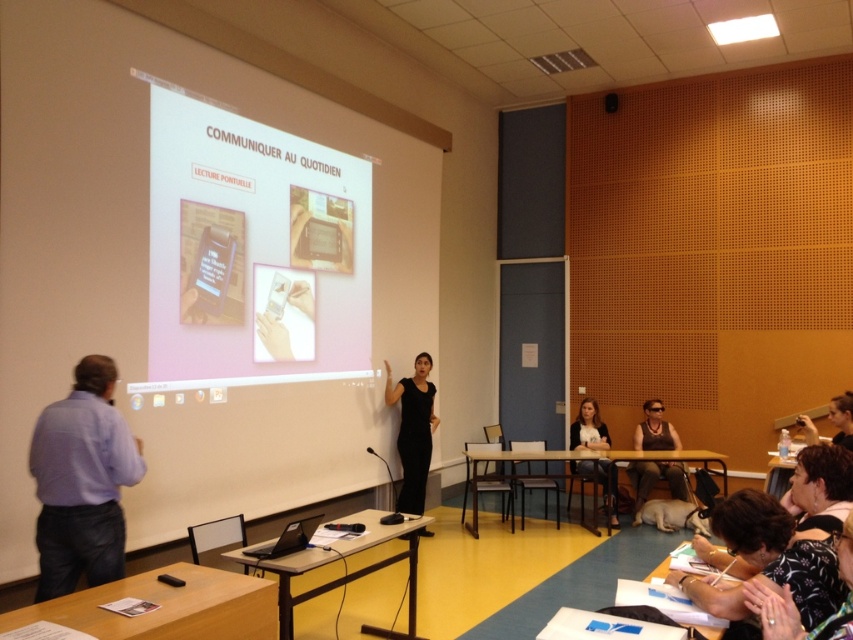
You are a photographer in the classroom and want to take a photo of both the black matte dress at center and the matte black tank top at lower right. Which one is positioned to the left side of the other?

The black matte dress at center is to the left of matte black tank top at lower right.

You are standing in the classroom and want to hand a note to the person wearing the purple shirt at left. Based on their current position, where should you approach from to reach them?

The purple shirt at left is positioned at point 0.753 on the horizontal axis and 0.097 on the vertical axis. To approach them effectively, you should move towards their current coordinates from any direction, but considering the classroom layout, approaching from the front or side would be most appropriate.